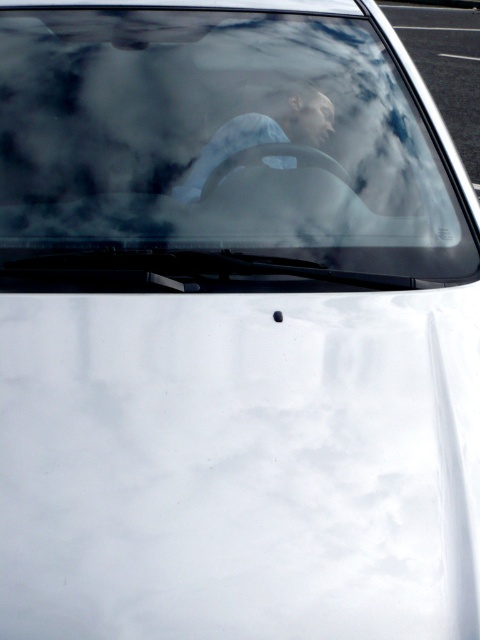
Question: Does transparent glass windshield at upper center have a greater width compared to asphalt at upper right?

Choices:
 (A) yes
 (B) no

Answer: (B)

Question: Which object is farther from the camera taking this photo?

Choices:
 (A) asphalt at upper right
 (B) blue fabric shirt at center
 (C) transparent glass windshield at upper center

Answer: (A)

Question: Does asphalt at upper right come behind blue fabric shirt at center?

Choices:
 (A) no
 (B) yes

Answer: (B)

Question: Which is nearer to the transparent glass windshield at upper center?

Choices:
 (A) blue fabric shirt at center
 (B) asphalt at upper right

Answer: (A)

Question: Is the position of transparent glass windshield at upper center less distant than that of blue fabric shirt at center?

Choices:
 (A) yes
 (B) no

Answer: (A)

Question: Based on their relative distances, which object is farther from the transparent glass windshield at upper center?

Choices:
 (A) asphalt at upper right
 (B) blue fabric shirt at center

Answer: (A)